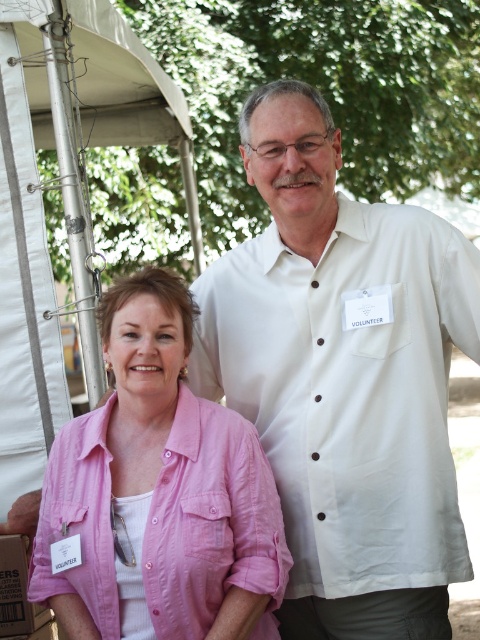
Can you confirm if white cotton shirt at upper right is bigger than pink cotton shirt at center?

Indeed, white cotton shirt at upper right has a larger size compared to pink cotton shirt at center.

Which is above, white cotton shirt at upper right or pink cotton shirt at center?

white cotton shirt at upper right

In the scene shown: Who is more forward, (346,476) or (163,394)?

Point (163,394) is more forward.

This screenshot has height=640, width=480. I want to click on white cotton shirt at upper right, so click(349, 388).

Is white fabric tent at upper left smaller than cardboard box at lower left?

Actually, white fabric tent at upper left might be larger than cardboard box at lower left.

Is point (103, 113) positioned behind point (34, 624)?

That is True.

You are a GUI agent. You are given a task and a screenshot of the screen. Output one action in this format:
    pyautogui.click(x=<x>, y=<y>)
    Task: Click on the white fabric tent at upper left
    The height and width of the screenshot is (640, 480).
    Given the screenshot: What is the action you would take?
    pyautogui.click(x=63, y=209)

Who is shorter, pink cotton shirt at center or cardboard box at lower left?

cardboard box at lower left is shorter.

Which is above, pink cotton shirt at center or cardboard box at lower left?

pink cotton shirt at center is above.

Does point (242, 547) come closer to viewer compared to point (20, 627)?

Yes, it is in front of point (20, 627).

This screenshot has width=480, height=640. Identify the location of pink cotton shirt at center. (160, 484).